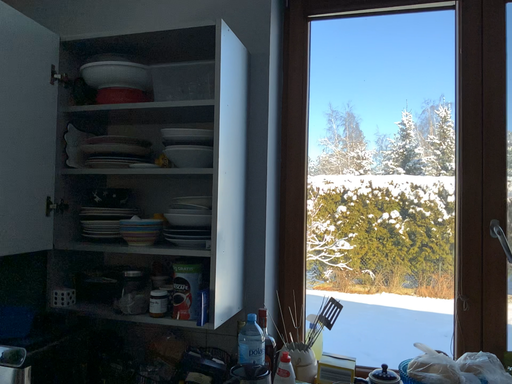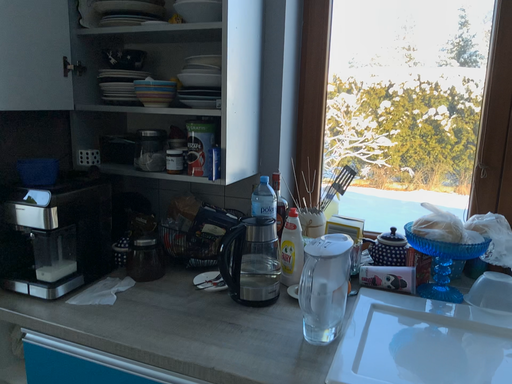
Question: How did the camera likely rotate when shooting the video?

Choices:
 (A) rotated downward
 (B) rotated upward

Answer: (A)